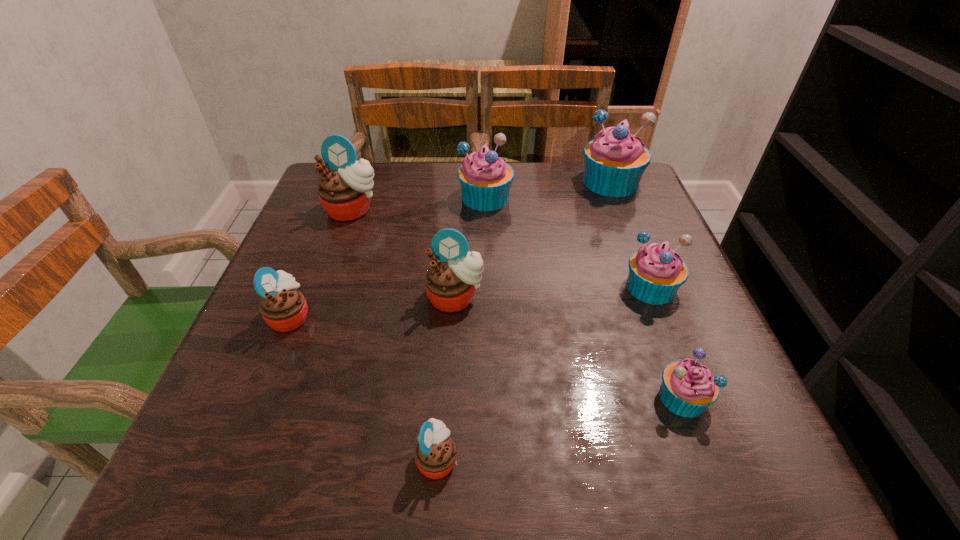
You are a GUI agent. You are given a task and a screenshot of the screen. Output one action in this format:
    pyautogui.click(x=<x>, y=<y>)
    Task: Click on the free space located 0.160m on the left of the biggest blue muffin
    
    Given the screenshot: What is the action you would take?
    pyautogui.click(x=518, y=182)

The height and width of the screenshot is (540, 960). Find the location of `free point located on the front-facing side of the farthest pink muffin`. free point located on the front-facing side of the farthest pink muffin is located at coordinates (325, 285).

Find the location of `vacant area situated 0.330m on the left of the leftmost blue muffin`. vacant area situated 0.330m on the left of the leftmost blue muffin is located at coordinates pos(326,197).

Where is `vacant space located on the front-facing side of the third smallest pink muffin`? The width and height of the screenshot is (960, 540). vacant space located on the front-facing side of the third smallest pink muffin is located at coordinates [x=451, y=370].

The width and height of the screenshot is (960, 540). In order to click on free region located 0.190m on the front-facing side of the third biggest pink muffin in this screenshot , I will do `click(413, 316)`.

This screenshot has height=540, width=960. Find the location of `free space located on the left of the third farthest blue muffin`. free space located on the left of the third farthest blue muffin is located at coordinates (428, 287).

You are a GUI agent. You are given a task and a screenshot of the screen. Output one action in this format:
    pyautogui.click(x=<x>, y=<y>)
    Task: Click on the blank area located on the back of the second nearest object
    
    Given the screenshot: What is the action you would take?
    pyautogui.click(x=629, y=253)

Find the location of `vacant space located on the front-facing side of the nearest pink muffin`. vacant space located on the front-facing side of the nearest pink muffin is located at coordinates (618, 458).

Image resolution: width=960 pixels, height=540 pixels. In order to click on object at the near edge in this screenshot , I will do `click(435, 455)`.

Locate an element on the screen. Image resolution: width=960 pixels, height=540 pixels. object at the far left corner is located at coordinates (344, 192).